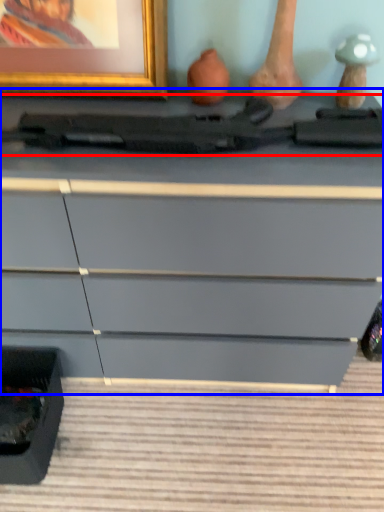
Question: Which of the following is the farthest to the observer, equipment (highlighted by a red box) or chest of drawers (highlighted by a blue box)?

Choices:
 (A) equipment
 (B) chest of drawers

Answer: (A)